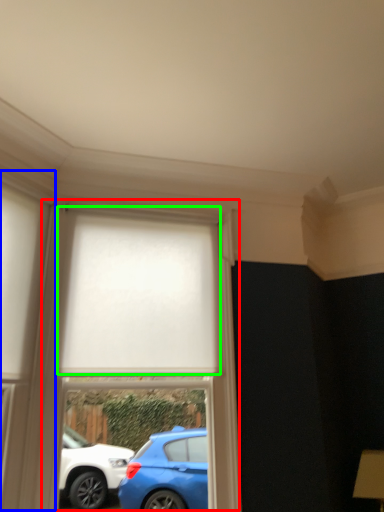
Question: Which object is the farthest from bay window (highlighted by a red box)? Choose among these: glass door (highlighted by a blue box) or curtain (highlighted by a green box).

Choices:
 (A) glass door
 (B) curtain

Answer: (A)